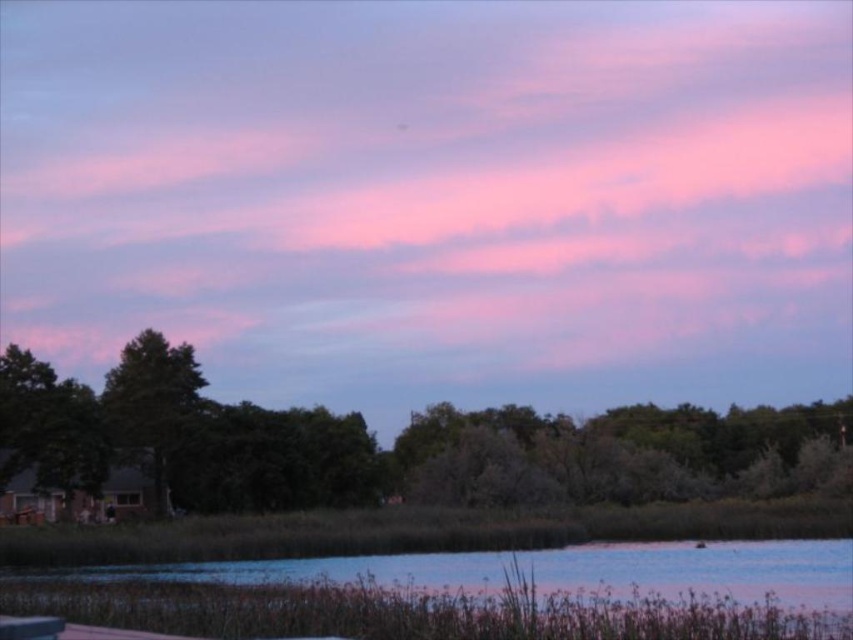
Can you confirm if pink fluffy cloud at upper center is positioned above green leafy tree at lower left?

Correct, pink fluffy cloud at upper center is located above green leafy tree at lower left.

Who is positioned more to the left, pink fluffy cloud at upper center or green leafy tree at lower left?

pink fluffy cloud at upper center is more to the left.

Consider the image. Who is more distant from viewer, [670,97] or [782,442]?

The point [670,97] is behind.

Identify the location of pink fluffy cloud at upper center. (434, 196).

Does green leafy tree at lower left have a greater width compared to green leafy tree at left?

Yes.

Does green leafy tree at lower left have a lesser width compared to green leafy tree at left?

No.

Locate an element on the screen. This screenshot has width=853, height=640. green leafy tree at lower left is located at coordinates (379, 448).

Does pink fluffy cloud at upper center appear on the right side of blue water at lower center?

No, pink fluffy cloud at upper center is not to the right of blue water at lower center.

Which is behind, point (311, 385) or point (218, 576)?

Point (311, 385)

Does point (438, 356) come farther from viewer compared to point (683, 563)?

Yes.

This screenshot has width=853, height=640. I want to click on pink fluffy cloud at upper center, so click(x=434, y=196).